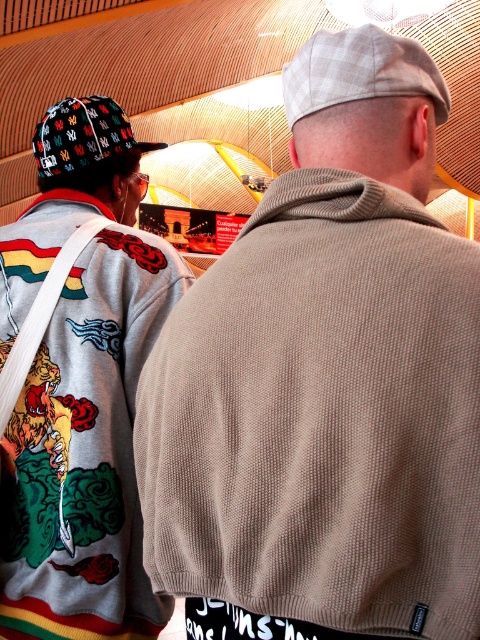
Between matte gray sweatshirt with colorful design at left and light gray plaid baseball cap at upper center, which one has more height?

matte gray sweatshirt with colorful design at left

Between point (33, 227) and point (422, 68), which one is positioned behind?

Point (33, 227)

Is point (57, 400) positioned before point (364, 67)?

No.

Locate an element on the screen. The height and width of the screenshot is (640, 480). matte gray sweatshirt with colorful design at left is located at coordinates (81, 387).

Does beige textured sweater at center have a greater height compared to light gray plaid baseball cap at upper center?

Correct, beige textured sweater at center is much taller as light gray plaid baseball cap at upper center.

Can you confirm if beige textured sweater at center is positioned to the right of light gray plaid baseball cap at upper center?

In fact, beige textured sweater at center is to the left of light gray plaid baseball cap at upper center.

Is point (305, 269) less distant than point (419, 54)?

That is True.

The height and width of the screenshot is (640, 480). I want to click on beige textured sweater at center, so click(325, 381).

What do you see at coordinates (360, 72) in the screenshot?
I see `light gray plaid baseball cap at upper center` at bounding box center [360, 72].

Can you confirm if light gray plaid baseball cap at upper center is positioned to the left of multicolored fabric baseball cap at left?

In fact, light gray plaid baseball cap at upper center is to the right of multicolored fabric baseball cap at left.

What do you see at coordinates (360, 72) in the screenshot? I see `light gray plaid baseball cap at upper center` at bounding box center [360, 72].

This screenshot has height=640, width=480. I want to click on light gray plaid baseball cap at upper center, so click(x=360, y=72).